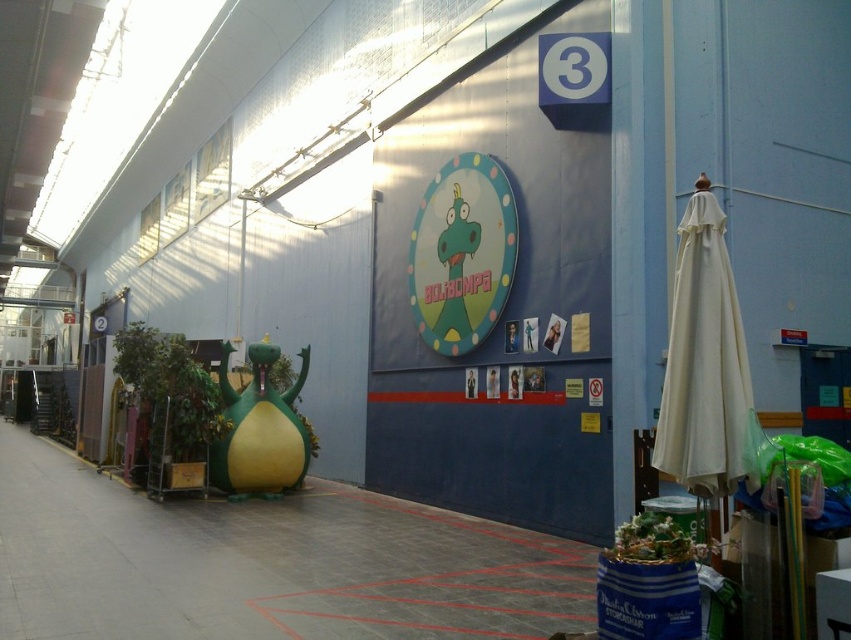
Question: Which point is farther to the camera?

Choices:
 (A) (420, 204)
 (B) (412, 292)

Answer: (B)

Question: Does matte blue bulletin board at center appear on the right side of matte plastic clock at center?

Choices:
 (A) no
 (B) yes

Answer: (B)

Question: Can you confirm if matte blue bulletin board at center is smaller than matte plastic clock at center?

Choices:
 (A) yes
 (B) no

Answer: (A)

Question: Which point is closer to the camera taking this photo?

Choices:
 (A) (391, 288)
 (B) (477, 336)

Answer: (B)

Question: In this image, where is matte blue bulletin board at center located relative to matte plastic clock at center?

Choices:
 (A) left
 (B) right

Answer: (B)